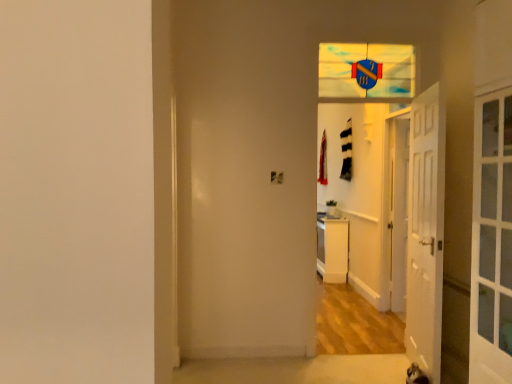
Identify the location of blank space situated above stained glass shield at upper center (from a real-world perspective). (351, 28).